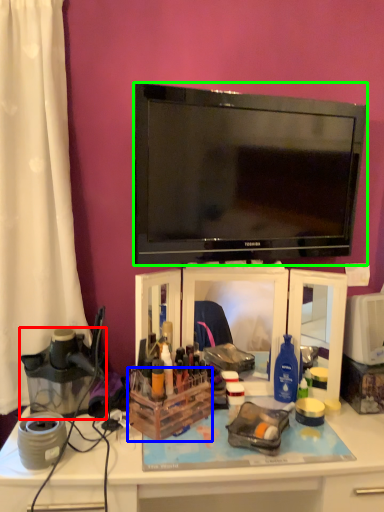
Question: Based on their relative distances, which object is farther from appliance (highlighted by a red box)? Choose from storage box (highlighted by a blue box) and television (highlighted by a green box).

Choices:
 (A) storage box
 (B) television

Answer: (B)